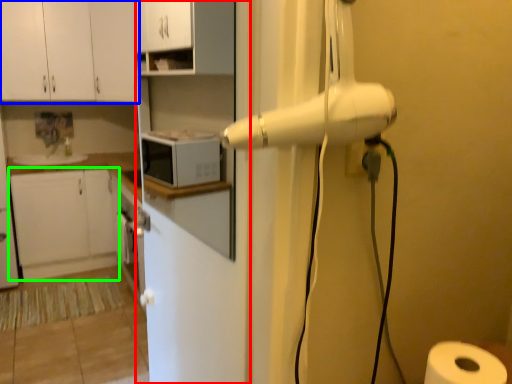
Question: Which is farther away from screen door (highlighted by a red box)? cabinetry (highlighted by a blue box) or cabinetry (highlighted by a green box)?

Choices:
 (A) cabinetry
 (B) cabinetry

Answer: (B)